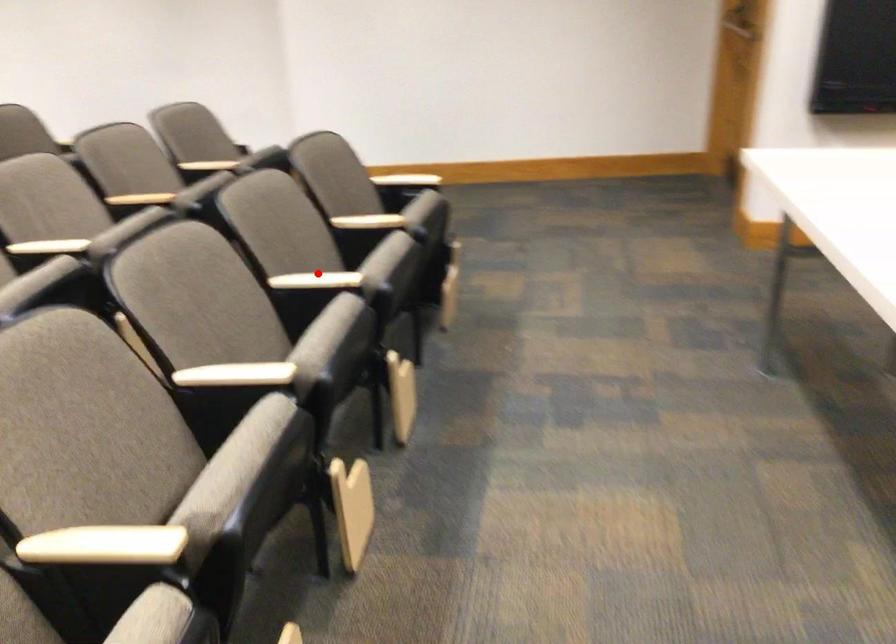
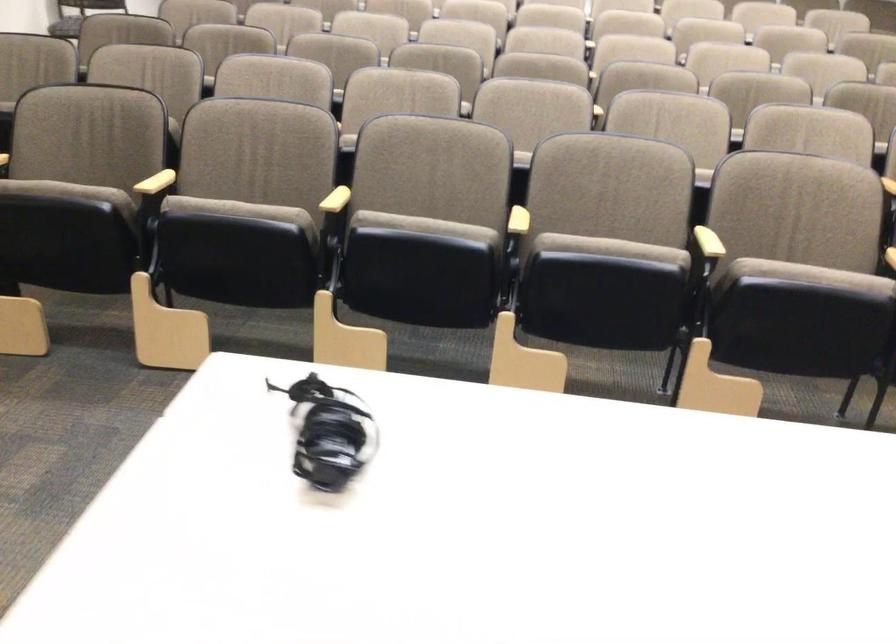
Find the pixel in the second image that matches the highlighted location in the first image.

(709, 242)